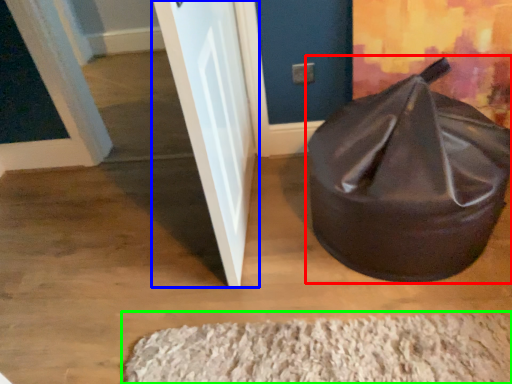
Question: Based on their relative distances, which object is farther from bean bag chair (highlighted by a red box)? Choose from door (highlighted by a blue box) and doormat (highlighted by a green box).

Choices:
 (A) door
 (B) doormat

Answer: (A)